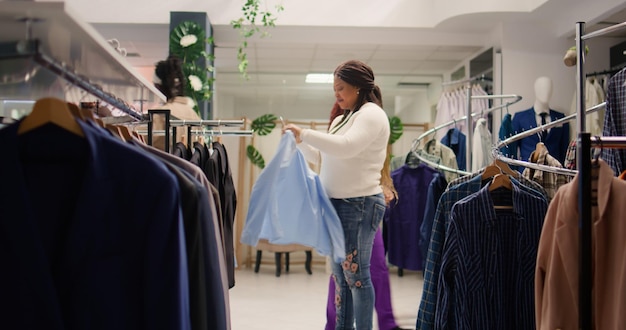
In order to click on overhead light in this screenshot , I will do `click(321, 76)`.